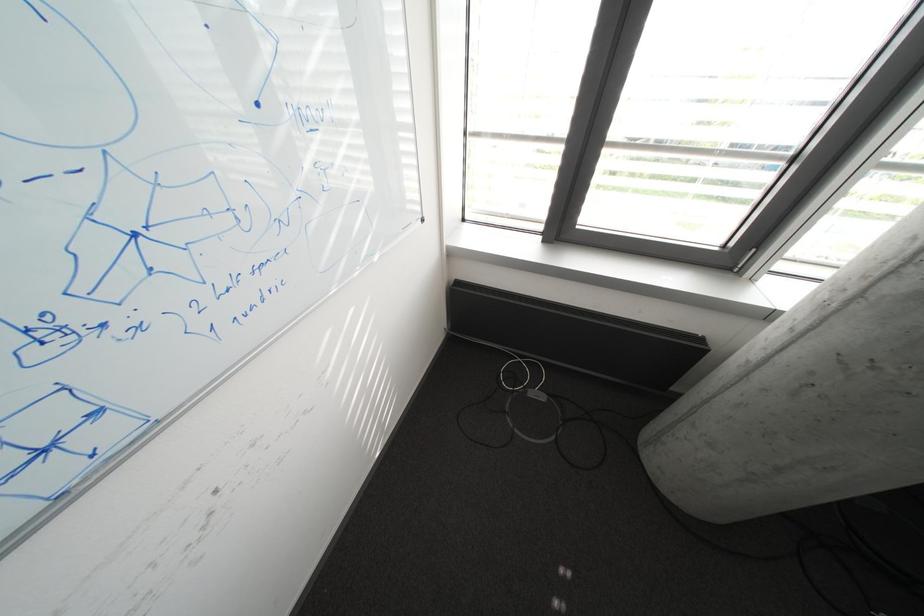
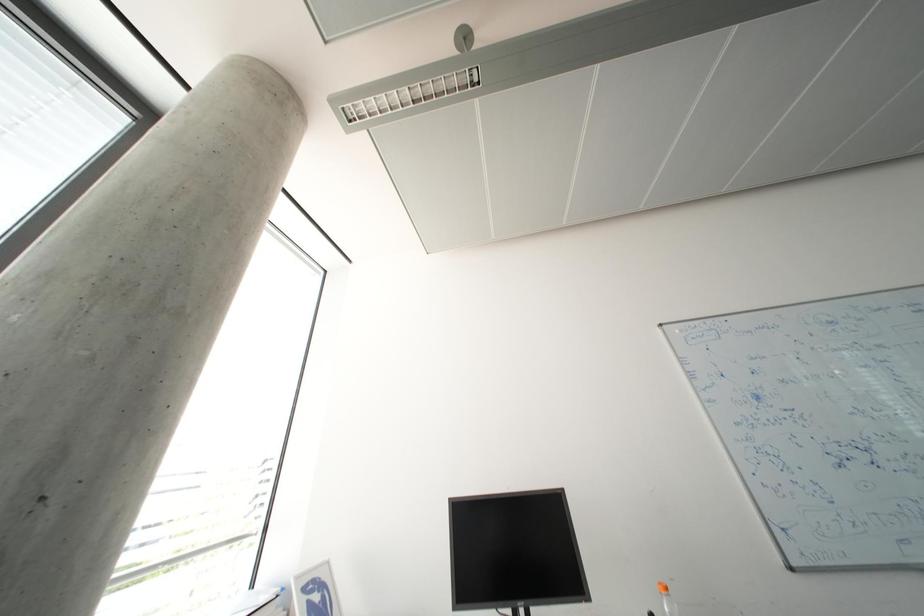
Question: The first image is from the beginning of the video and the second image is from the end. How did the camera likely rotate when shooting the video?

Choices:
 (A) Left
 (B) Right
 (C) Up
 (D) Down

Answer: (B)